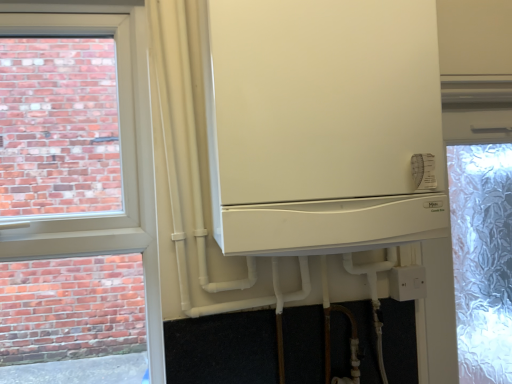
Question: Looking at the image, does white plastic electric outlet at lower right seem bigger or smaller compared to white matte refrigerator at center?

Choices:
 (A) big
 (B) small

Answer: (B)

Question: Is point (403, 273) positioned closer to the camera than point (407, 36)?

Choices:
 (A) farther
 (B) closer

Answer: (A)

Question: Is white plastic electric outlet at lower right taller or shorter than white matte refrigerator at center?

Choices:
 (A) tall
 (B) short

Answer: (B)

Question: Is white matte refrigerator at center situated inside white plastic electric outlet at lower right or outside?

Choices:
 (A) outside
 (B) inside

Answer: (A)

Question: Considering the positions of point (395, 200) and point (402, 297), is point (395, 200) closer or farther from the camera than point (402, 297)?

Choices:
 (A) farther
 (B) closer

Answer: (B)

Question: Considering the relative positions of white matte refrigerator at center and white plastic electric outlet at lower right in the image provided, is white matte refrigerator at center to the left or to the right of white plastic electric outlet at lower right?

Choices:
 (A) right
 (B) left

Answer: (B)

Question: From their relative heights in the image, would you say white matte refrigerator at center is taller or shorter than white plastic electric outlet at lower right?

Choices:
 (A) tall
 (B) short

Answer: (A)